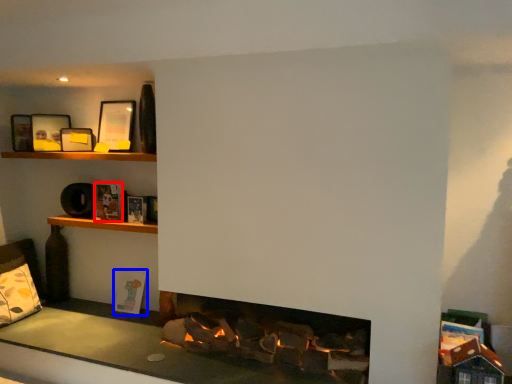
Question: Among these objects, which one is nearest to the camera, book (highlighted by a red box) or book (highlighted by a blue box)?

Choices:
 (A) book
 (B) book

Answer: (A)